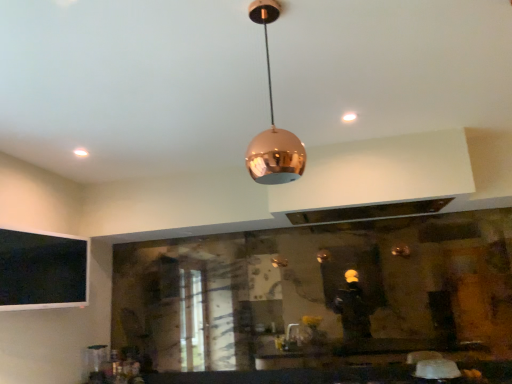
Describe the element at coordinates (273, 123) in the screenshot. The width and height of the screenshot is (512, 384). I see `copper/metallic sphere at center` at that location.

Locate an element on the screen. Image resolution: width=512 pixels, height=384 pixels. copper/metallic sphere at center is located at coordinates (273, 123).

Locate an element on the screen. This screenshot has height=384, width=512. copper/metallic sphere at center is located at coordinates (273, 123).